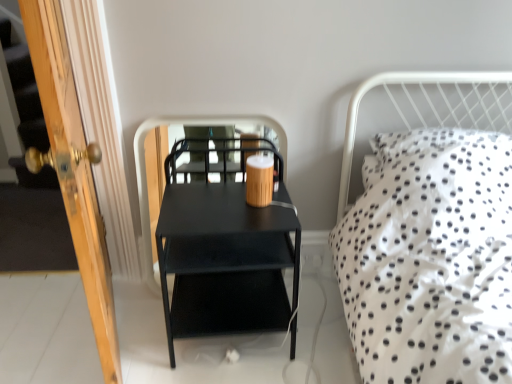
Where is `matte black nightstand at center`? This screenshot has width=512, height=384. matte black nightstand at center is located at coordinates (224, 262).

The width and height of the screenshot is (512, 384). What are the coordinates of `black matte side table at center` in the screenshot? It's located at (146, 175).

You are a GUI agent. You are given a task and a screenshot of the screen. Output one action in this format:
    pyautogui.click(x=<x>, y=<y>)
    Task: Click on the wooden coffee cup at center
    This screenshot has height=384, width=512.
    Given the screenshot: What is the action you would take?
    pyautogui.click(x=259, y=180)

In order to face wooden door at left, should I rotate leftwards or rightwards?

A 21.929 degree turn to the left will do.

Image resolution: width=512 pixels, height=384 pixels. I want to click on matte black nightstand at center, so [224, 262].

Where is `coffee cup above the matte black nightstand at center (from a real-world perspective)`? coffee cup above the matte black nightstand at center (from a real-world perspective) is located at coordinates (259, 180).

From a real-world perspective, is matte black nightstand at center physically located above or below wooden coffee cup at center?

matte black nightstand at center is situated lower than wooden coffee cup at center in the real world.

In the scene shown: Is matte black nightstand at center to the left or to the right of wooden coffee cup at center in the image?

In the image, matte black nightstand at center appears on the left side of wooden coffee cup at center.

Between matte black nightstand at center and black matte side table at center, which one is positioned behind?

black matte side table at center is behind.

Could you tell me if matte black nightstand at center is facing black matte side table at center?

Yes, matte black nightstand at center is facing black matte side table at center.

Which is behind, point (170, 334) or point (156, 289)?

The point (156, 289) is behind.

From the image's perspective, does matte black nightstand at center appear lower than black matte side table at center?

Yes, from the image's perspective, matte black nightstand at center is beneath black matte side table at center.

From a real-world perspective, which is physically above, black matte side table at center or matte black nightstand at center?

In real-world perspective, black matte side table at center is above.

Is black matte side table at center outside of matte black nightstand at center?

Indeed, black matte side table at center is completely outside matte black nightstand at center.

Is black matte side table at center not near matte black nightstand at center?

No, black matte side table at center is not far from matte black nightstand at center.

Considering the relative sizes of black matte side table at center and matte black nightstand at center in the image provided, is black matte side table at center bigger than matte black nightstand at center?

Actually, black matte side table at center might be smaller than matte black nightstand at center.

Is matte black nightstand at center in front of or behind wooden door at left in the image?

Visually, matte black nightstand at center is located behind wooden door at left.

Looking at this image, between matte black nightstand at center and wooden door at left, which one has less height?

Standing shorter between the two is matte black nightstand at center.

Does point (246, 280) come farther from viewer compared to point (93, 208)?

Yes, point (246, 280) is farther from viewer.

In terms of width, does matte black nightstand at center look wider or thinner when compared to wooden door at left?

Clearly, matte black nightstand at center has less width compared to wooden door at left.

Would you say wooden door at left is to the left or to the right of wooden coffee cup at center in the picture?

Based on their positions, wooden door at left is located to the left of wooden coffee cup at center.

Considering the relative positions of wooden door at left and wooden coffee cup at center in the image provided, is wooden door at left behind wooden coffee cup at center?

No, the depth of wooden door at left is less than that of wooden coffee cup at center.

Is point (71, 131) closer to camera compared to point (257, 193)?

Yes, it is in front of point (257, 193).

Can you confirm if wooden door at left is taller than wooden coffee cup at center?

Correct, wooden door at left is much taller as wooden coffee cup at center.

You are a GUI agent. You are given a task and a screenshot of the screen. Output one action in this format:
    pyautogui.click(x=<x>, y=<y>)
    Task: Click on the screen door below the wooden door at left (from the image's perspective)
    
    Given the screenshot: What is the action you would take?
    pyautogui.click(x=146, y=175)

From the image's perspective, which object appears higher, black matte side table at center or wooden door at left?

wooden door at left.

Is black matte side table at center with wooden door at left?

No, black matte side table at center is not in contact with wooden door at left.

From a real-world perspective, does black matte side table at center sit lower than wooden door at left?

Indeed, from a real-world perspective, black matte side table at center is positioned beneath wooden door at left.

Are black matte side table at center and wooden coffee cup at center far apart?

No, black matte side table at center is not far away from wooden coffee cup at center.

Can you tell me how much black matte side table at center and wooden coffee cup at center differ in facing direction?

The facing directions of black matte side table at center and wooden coffee cup at center are 0.691 degrees apart.

From the image's perspective, is black matte side table at center above wooden coffee cup at center?

No.

In the image, is black matte side table at center on the left side or the right side of wooden coffee cup at center?

black matte side table at center is positioned on wooden coffee cup at center's left side.

Locate an element on the screen. Image resolution: width=512 pixels, height=384 pixels. nightstand below the wooden coffee cup at center (from the image's perspective) is located at coordinates (224, 262).

Where is `nightstand that is on the right side of black matte side table at center`? The width and height of the screenshot is (512, 384). nightstand that is on the right side of black matte side table at center is located at coordinates (224, 262).

Which object lies further to the anchor point wooden door at left, wooden coffee cup at center or black matte side table at center?

The object further to wooden door at left is black matte side table at center.

Looking at the image, which one is located further to matte black nightstand at center, black matte side table at center or wooden coffee cup at center?

black matte side table at center.

Looking at the image, which one is located closer to wooden coffee cup at center, matte black nightstand at center or wooden door at left?

matte black nightstand at center lies closer to wooden coffee cup at center than the other object.

Considering their positions, is wooden coffee cup at center positioned further to black matte side table at center than wooden door at left?

Based on the image, wooden door at left appears to be further to black matte side table at center.

Looking at the image, which one is located further to matte black nightstand at center, wooden door at left or wooden coffee cup at center?

Based on the image, wooden door at left appears to be further to matte black nightstand at center.

From the image, which object appears to be nearer to wooden door at left, matte black nightstand at center or wooden coffee cup at center?

Based on the image, matte black nightstand at center appears to be nearer to wooden door at left.

Looking at the image, which one is located further to black matte side table at center, matte black nightstand at center or wooden coffee cup at center?

wooden coffee cup at center lies further to black matte side table at center than the other object.

Estimate the real-world distances between objects in this image. Which object is closer to wooden door at left, black matte side table at center or matte black nightstand at center?

Among the two, matte black nightstand at center is located nearer to wooden door at left.

The height and width of the screenshot is (384, 512). What are the coordinates of `nightstand located between wooden door at left and wooden coffee cup at center in the depth direction` in the screenshot? It's located at (224, 262).

Identify the location of nightstand between wooden door at left and black matte side table at center in the front-back direction. Image resolution: width=512 pixels, height=384 pixels. (224, 262).

You are a GUI agent. You are given a task and a screenshot of the screen. Output one action in this format:
    pyautogui.click(x=<x>, y=<y>)
    Task: Click on the coffee cup between wooden door at left and black matte side table at center from front to back
    
    Given the screenshot: What is the action you would take?
    pyautogui.click(x=259, y=180)

Find the location of a particular element. The image size is (512, 384). coffee cup located between matte black nightstand at center and black matte side table at center in the depth direction is located at coordinates pyautogui.click(x=259, y=180).